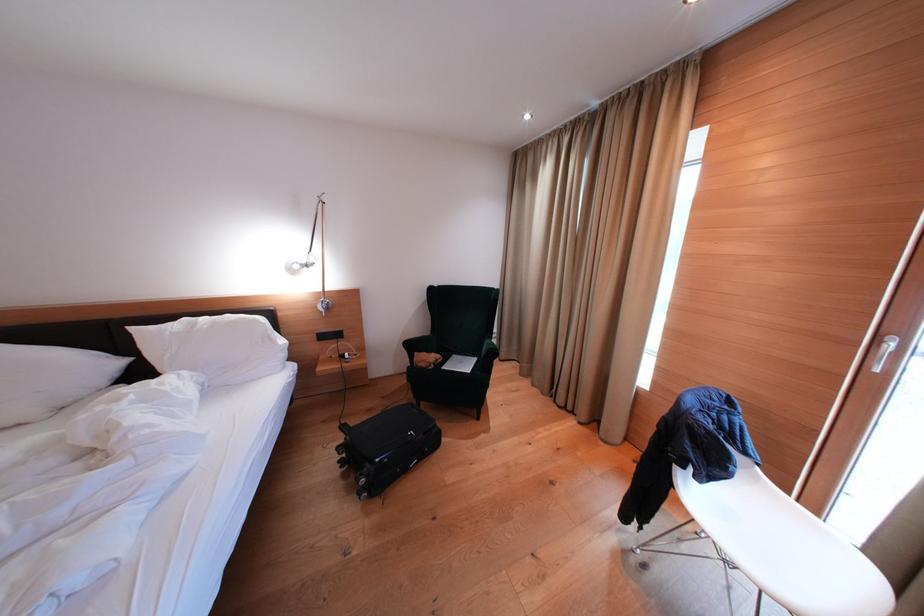
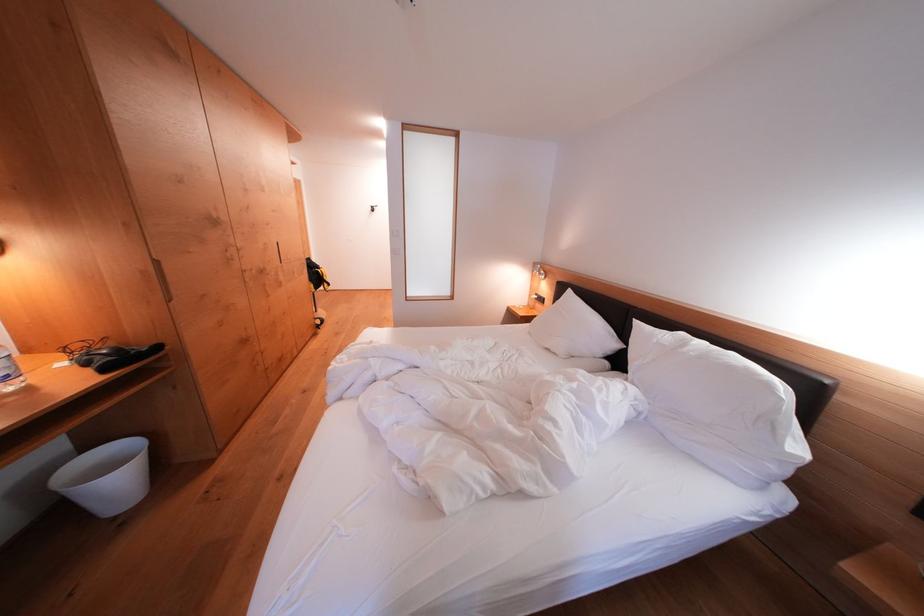
Find the pixel in the second image that matches pixel 140 334 in the first image.

(642, 326)